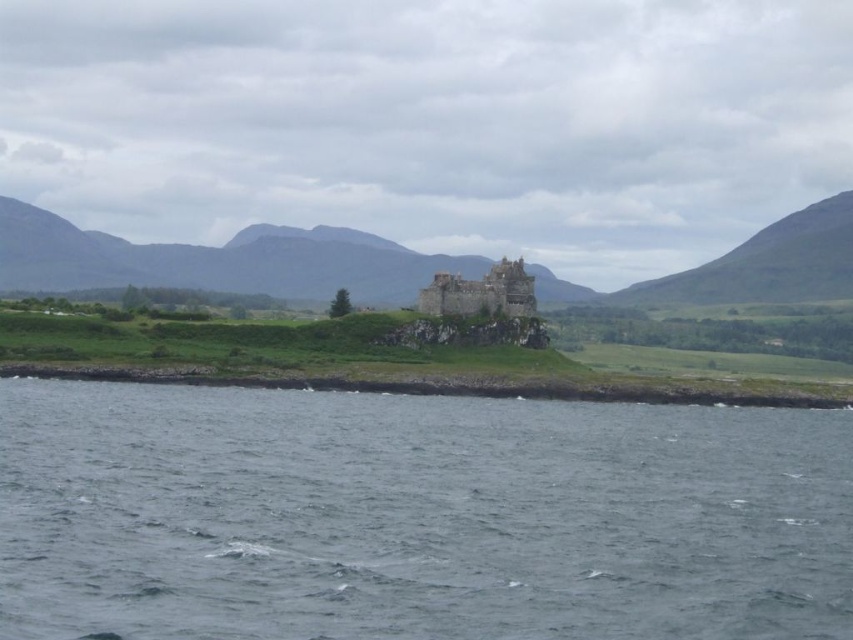
Question: Among these objects, which one is nearest to the camera?

Choices:
 (A) rustic stone castle at center
 (B) gray water at lower center
 (C) green grassy hill at center
 (D) green grassy shoreline at lower center

Answer: (B)

Question: Can you confirm if green grassy hill at right is positioned to the left of rustic stone castle at center?

Choices:
 (A) no
 (B) yes

Answer: (A)

Question: Does gray water at lower center have a smaller size compared to green grassy hill at center?

Choices:
 (A) yes
 (B) no

Answer: (A)

Question: Which point is farther to the camera?

Choices:
 (A) gray water at lower center
 (B) green grassy hill at center

Answer: (B)

Question: Does gray water at lower center appear over green grassy hill at center?

Choices:
 (A) no
 (B) yes

Answer: (A)

Question: Which of these objects is positioned closest to the green grassy shoreline at lower center?

Choices:
 (A) gray water at lower center
 (B) rustic stone castle at center
 (C) green grassy hill at center

Answer: (B)